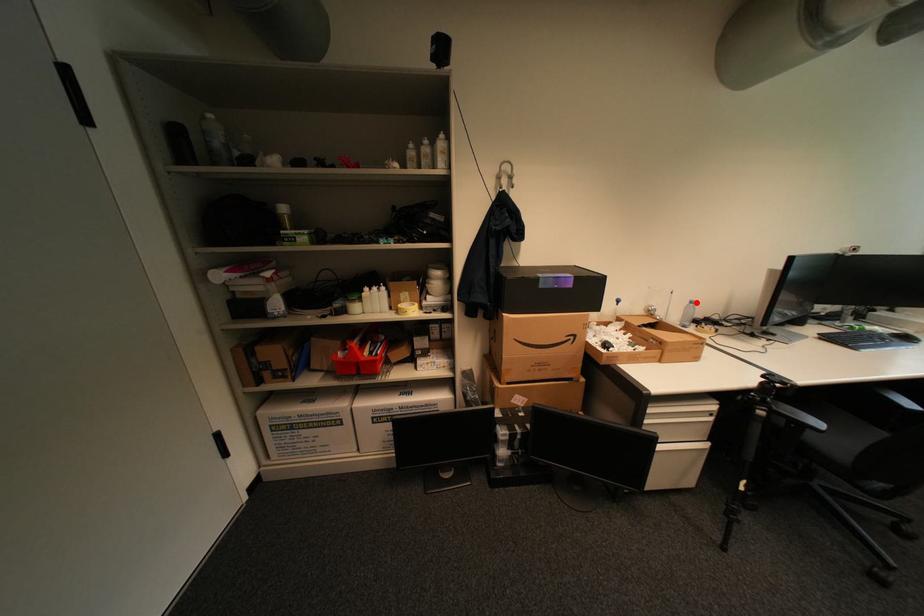
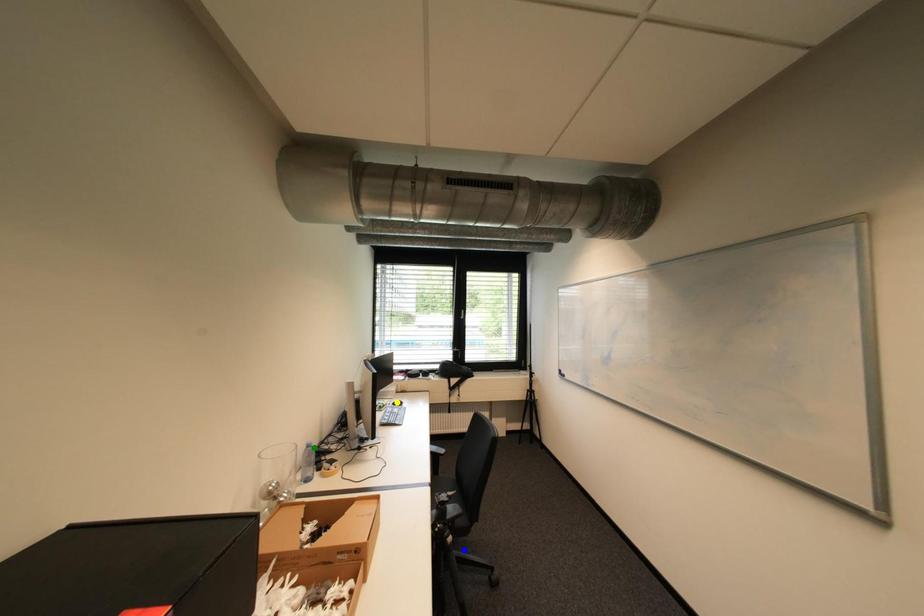
Question: I am providing you with two images of the same scene from different viewpoints. A red point is marked on the first image. You are given multiple points on the second image. Which point in image 2 represents the same 3d spot as the red point in image 1?

Choices:
 (A) green point
 (B) yellow point
 (C) blue point

Answer: (A)